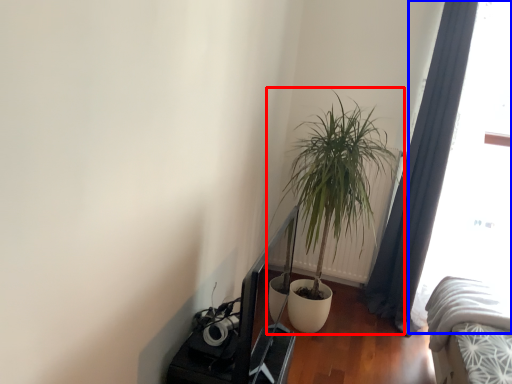
Question: Among these objects, which one is farthest to the camera, houseplant (highlighted by a red box) or window screen (highlighted by a blue box)?

Choices:
 (A) houseplant
 (B) window screen

Answer: (B)